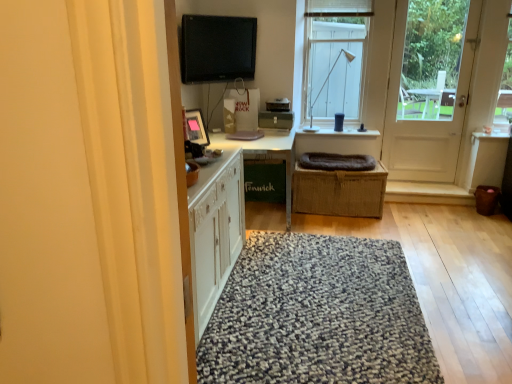
Image resolution: width=512 pixels, height=384 pixels. What do you see at coordinates (266, 155) in the screenshot?
I see `white glossy table at center` at bounding box center [266, 155].

This screenshot has height=384, width=512. Identify the location of black glossy computer monitor at upper center. (217, 48).

I want to click on white wooden door at right, so click(428, 87).

Is white wooden door at right wider or thinner than black glossy computer monitor at upper center?

In the image, white wooden door at right appears to be wider than black glossy computer monitor at upper center.

What's the angular difference between white wooden door at right and black glossy computer monitor at upper center's facing directions?

50.8 degrees separate the facing orientations of white wooden door at right and black glossy computer monitor at upper center.

In the scene shown: Between white wooden door at right and black glossy computer monitor at upper center, which one is positioned behind?

white wooden door at right.

From the image's perspective, who appears lower, white glossy table at center or textured gray rug at center?

textured gray rug at center appears lower in the image.

Considering the relative sizes of white glossy table at center and textured gray rug at center in the image provided, is white glossy table at center taller than textured gray rug at center?

Yes.

Considering the positions of point (291, 167) and point (309, 376), is point (291, 167) closer or farther from the camera than point (309, 376)?

Clearly, point (291, 167) is more distant from the camera than point (309, 376).

Is point (315, 131) positioned in front of point (311, 113)?

That is True.

Is matte black lamp at upper center facing towards white glass window at upper center?

No, matte black lamp at upper center is not oriented towards white glass window at upper center.

From the image's perspective, which one is positioned lower, matte black lamp at upper center or white glass window at upper center?

matte black lamp at upper center is shown below in the image.

Is matte black lamp at upper center completely or partially outside of white glass window at upper center?

matte black lamp at upper center lies outside white glass window at upper center's area.

Which of these two, white glossy table at center or black glossy computer monitor at upper center, is thinner?

black glossy computer monitor at upper center.

Considering the sizes of objects white glossy table at center and black glossy computer monitor at upper center in the image provided, who is smaller, white glossy table at center or black glossy computer monitor at upper center?

Smaller between the two is black glossy computer monitor at upper center.

Is white glossy table at center facing towards black glossy computer monitor at upper center?

No.

From a real-world perspective, which object rests below the other?

textured gray rug at center, from a real-world perspective.

Can you tell me how much white wooden door at right and textured gray rug at center differ in facing direction?

0.48 degrees.

Considering the sizes of objects white wooden door at right and textured gray rug at center in the image provided, who is smaller, white wooden door at right or textured gray rug at center?

Smaller between the two is textured gray rug at center.

Which point is more distant from viewer, (402, 72) or (255, 288)?

Positioned behind is point (402, 72).

Between black glossy computer monitor at upper center and white glossy table at center, which one has smaller width?

black glossy computer monitor at upper center.

Can you confirm if black glossy computer monitor at upper center is shorter than white glossy table at center?

Correct, black glossy computer monitor at upper center is not as tall as white glossy table at center.

From the image's perspective, is black glossy computer monitor at upper center located above or below white glossy table at center?

black glossy computer monitor at upper center is above white glossy table at center.

Could you tell me if black glossy computer monitor at upper center is turned towards white glossy table at center?

No.

How many degrees apart are the facing directions of white wooden door at right and matte black lamp at upper center?

The facing directions of white wooden door at right and matte black lamp at upper center are 1.37 degrees apart.

Consider the image. From a real-world perspective, which object stands above the other?

From a 3D spatial view, matte black lamp at upper center is above.

From the image's perspective, between white wooden door at right and matte black lamp at upper center, which one is located above?

matte black lamp at upper center is shown above in the image.

Between white wooden door at right and matte black lamp at upper center, which one is positioned in front?

white wooden door at right is closer to the camera.

This screenshot has width=512, height=384. I want to click on computer monitor above the white wooden door at right (from the image's perspective), so click(217, 48).

Locate an element on the screen. This screenshot has width=512, height=384. doormat below the white glossy table at center (from a real-world perspective) is located at coordinates (317, 315).

Estimate the real-world distances between objects in this image. Which object is further from matte black lamp at upper center, white glass window at upper center or textured gray rug at center?

Among the two, textured gray rug at center is located further to matte black lamp at upper center.

Which object lies nearer to the anchor point matte black lamp at upper center, white wooden door at right or white glossy table at center?

The object closer to matte black lamp at upper center is white glossy table at center.

Which object lies nearer to the anchor point white wooden door at right, textured gray rug at center or black glossy computer monitor at upper center?

Among the two, black glossy computer monitor at upper center is located nearer to white wooden door at right.

From the image, which object appears to be nearer to matte black lamp at upper center, white glass window at upper center or white wooden door at right?

white glass window at upper center.

From the image, which object appears to be farther from matte black lamp at upper center, black glossy computer monitor at upper center or textured gray rug at center?

textured gray rug at center is positioned further to the anchor matte black lamp at upper center.

Which object lies nearer to the anchor point white glossy table at center, textured gray rug at center or white wooden door at right?

Based on the image, textured gray rug at center appears to be nearer to white glossy table at center.

Based on their spatial positions, is white glass window at upper center or matte black lamp at upper center further from white glossy table at center?

The object further to white glossy table at center is white glass window at upper center.

Considering their positions, is black glossy computer monitor at upper center positioned closer to matte black lamp at upper center than white wooden door at right?

white wooden door at right lies closer to matte black lamp at upper center than the other object.

The width and height of the screenshot is (512, 384). Find the location of `computer monitor that lies between white glass window at upper center and textured gray rug at center from top to bottom`. computer monitor that lies between white glass window at upper center and textured gray rug at center from top to bottom is located at coordinates (217, 48).

Locate an element on the screen. computer monitor between white glass window at upper center and white glossy table at center in the vertical direction is located at coordinates (217, 48).

Find the location of a particular element. This screenshot has height=384, width=512. computer monitor between textured gray rug at center and matte black lamp at upper center along the z-axis is located at coordinates (217, 48).

At what (x,y) coordinates should I click in order to perform the action: click on lamp between black glossy computer monitor at upper center and white glass window at upper center. Please return your answer as a coordinate pair (x, y). This screenshot has width=512, height=384. Looking at the image, I should click on (323, 87).